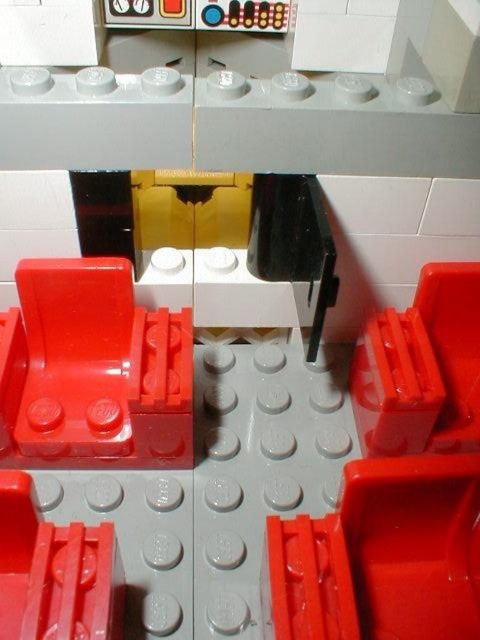
Question: Is matte red hinge at center above matte red hinge at lower left?

Choices:
 (A) no
 (B) yes

Answer: (B)

Question: Does matte red hinge at center appear under matte red hinge at lower left?

Choices:
 (A) yes
 (B) no

Answer: (B)

Question: Which object is closer to the camera taking this photo?

Choices:
 (A) matte red hinge at center
 (B) matte red hinge at lower left

Answer: (B)

Question: Is matte red hinge at center further to camera compared to matte red hinge at lower left?

Choices:
 (A) no
 (B) yes

Answer: (B)

Question: Which point is closer to the camera?

Choices:
 (A) (118, 330)
 (B) (112, 547)

Answer: (B)